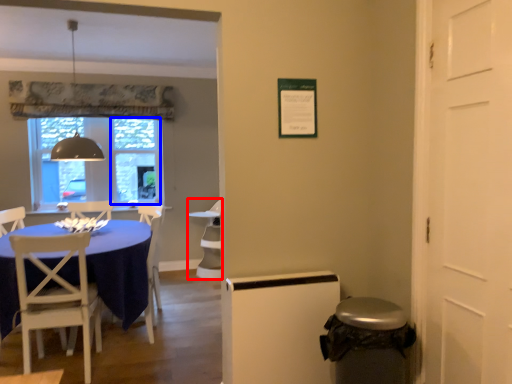
Question: Which object appears farthest to the camera in this image, armchair (highlighted by a red box) or glass door (highlighted by a blue box)?

Choices:
 (A) armchair
 (B) glass door

Answer: (B)